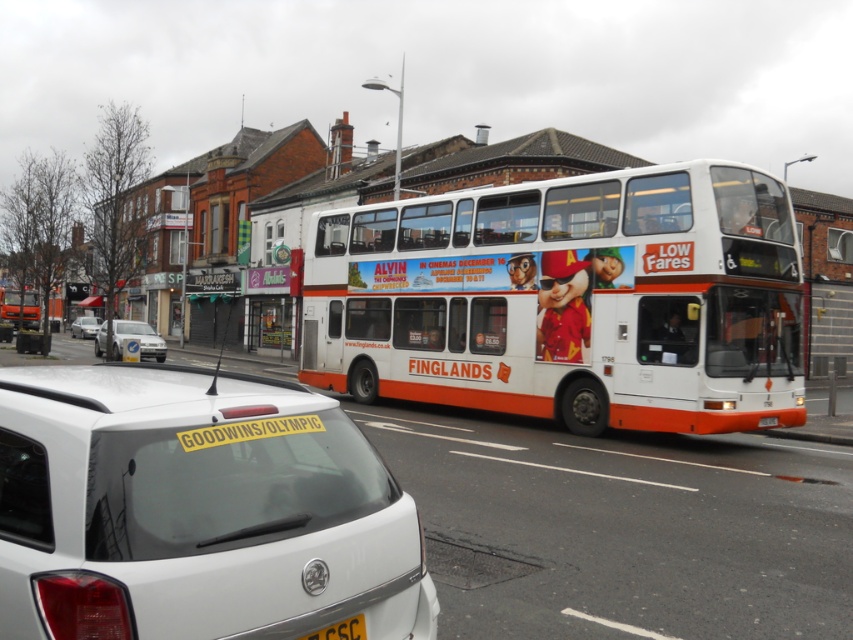
Question: Where is white matte hatchback at center located in relation to white matte sedan at center in the image?

Choices:
 (A) below
 (B) above

Answer: (A)

Question: Which object appears farthest from the camera in this image?

Choices:
 (A) white matte/deck bus at center
 (B) white matte hatchback at center
 (C) white plastic bus at center
 (D) white matte sedan at center

Answer: (D)

Question: Estimate the real-world distances between objects in this image. Which object is farther from the white matte van at left?

Choices:
 (A) white matte hatchback at center
 (B) white matte sedan at center
 (C) white plastic bus at center
 (D) yellow matte license plate at center

Answer: (A)

Question: Can you confirm if white matte van at left is positioned above yellow matte license plate at center?

Choices:
 (A) yes
 (B) no

Answer: (A)

Question: Which object is farther from the camera taking this photo?

Choices:
 (A) white matte van at left
 (B) yellow matte license plate at center

Answer: (A)

Question: Is white plastic bus at center behind yellow matte license plate at center?

Choices:
 (A) no
 (B) yes

Answer: (B)